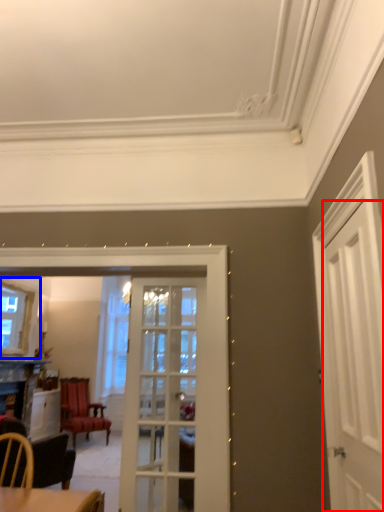
Question: Among these objects, which one is nearest to the camera, door (highlighted by a red box) or window (highlighted by a blue box)?

Choices:
 (A) door
 (B) window

Answer: (A)